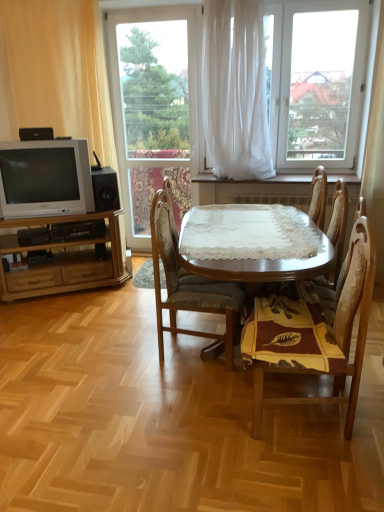
Question: Is white sheer curtain at center, the 1th curtain in the right-to-left sequence, taller or shorter than matte silver television at left?

Choices:
 (A) short
 (B) tall

Answer: (B)

Question: Looking at the image, does white sheer curtain at center, the 1th curtain in the right-to-left sequence, seem bigger or smaller compared to matte silver television at left?

Choices:
 (A) big
 (B) small

Answer: (A)

Question: Which object is the farthest from the transparent glass window at center, which ranks as the second window in right-to-left order?

Choices:
 (A) wooden chair at center, arranged as the 2th chair when viewed from the left
 (B) light brown wood entertainment center at left
 (C) matte silver television at left
 (D) wooden chair at center, which is the 1th chair from right to left
 (E) white sheer curtain at upper center, which appears as the first window when viewed from the right

Answer: (A)

Question: Which object is positioned closest to the light brown wood entertainment center at left?

Choices:
 (A) white sheer curtain at center, the 2th curtain positioned from the left
 (B) black plastic speaker at upper left, the second loudspeaker when ordered from bottom to top
 (C) white sheer curtain at upper center, which appears as the first window when viewed from the right
 (D) wooden chair at center, the third chair viewed from the right
 (E) wooden chair at center, arranged as the 2th chair when viewed from the left

Answer: (B)